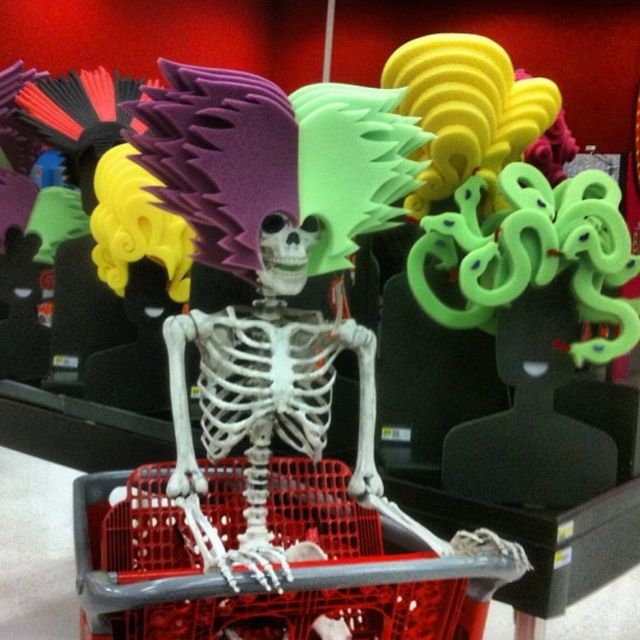
Question: Is red plastic shopping basket at center in front of green rubber snake at upper right?

Choices:
 (A) no
 (B) yes

Answer: (B)

Question: Which object is farther from the camera taking this photo?

Choices:
 (A) green rubber snake at upper right
 (B) red plastic shopping basket at center

Answer: (A)

Question: Is red plastic shopping basket at center further to camera compared to green rubber snake at upper right?

Choices:
 (A) no
 (B) yes

Answer: (A)

Question: Which object is farther from the camera taking this photo?

Choices:
 (A) red plastic shopping basket at center
 (B) green rubber snake at upper right

Answer: (B)

Question: Among these points, which one is farthest from the camera?

Choices:
 (A) (124, 528)
 (B) (529, 368)

Answer: (B)

Question: From the image, what is the correct spatial relationship of red plastic shopping basket at center in relation to green rubber snake at upper right?

Choices:
 (A) right
 (B) left

Answer: (B)